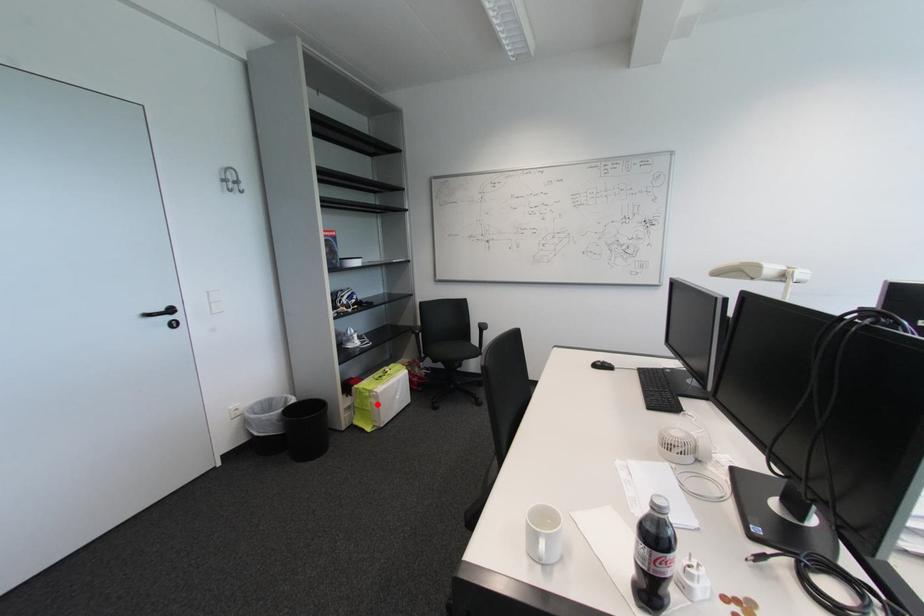
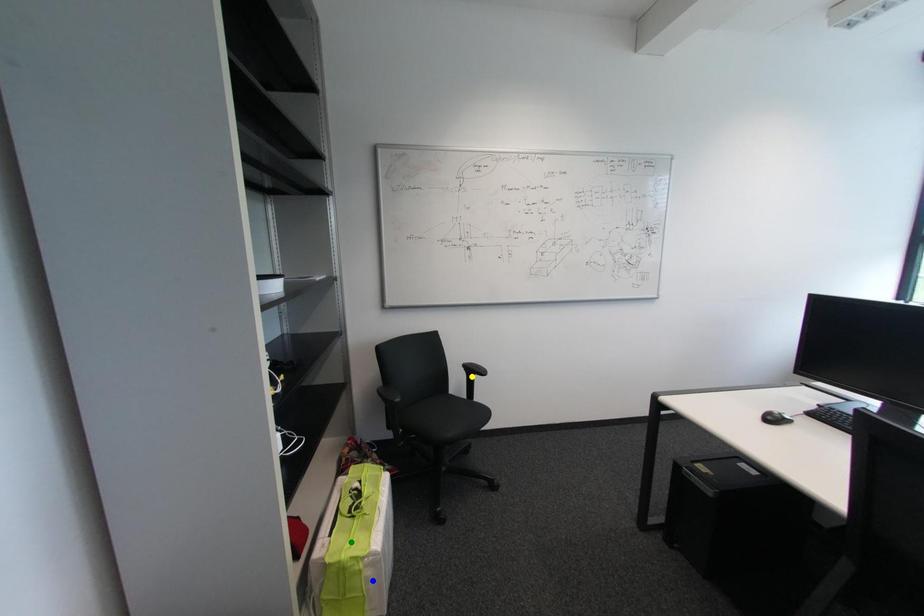
Question: I am providing you with two images of the same scene from different viewpoints. A red point is marked on the first image. You are given multiple points on the second image. Which point in image 2 is actually the same real-world point as the red point in image 1?

Choices:
 (A) yellow point
 (B) blue point
 (C) green point

Answer: (B)